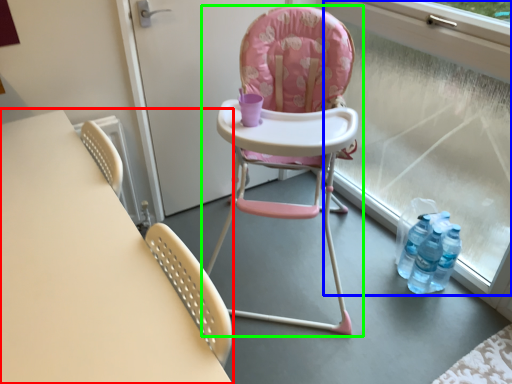
Question: Which object is positioned closest to table (highlighted by a red box)? Select from window frame (highlighted by a blue box) and chair (highlighted by a green box).

Choices:
 (A) window frame
 (B) chair

Answer: (B)